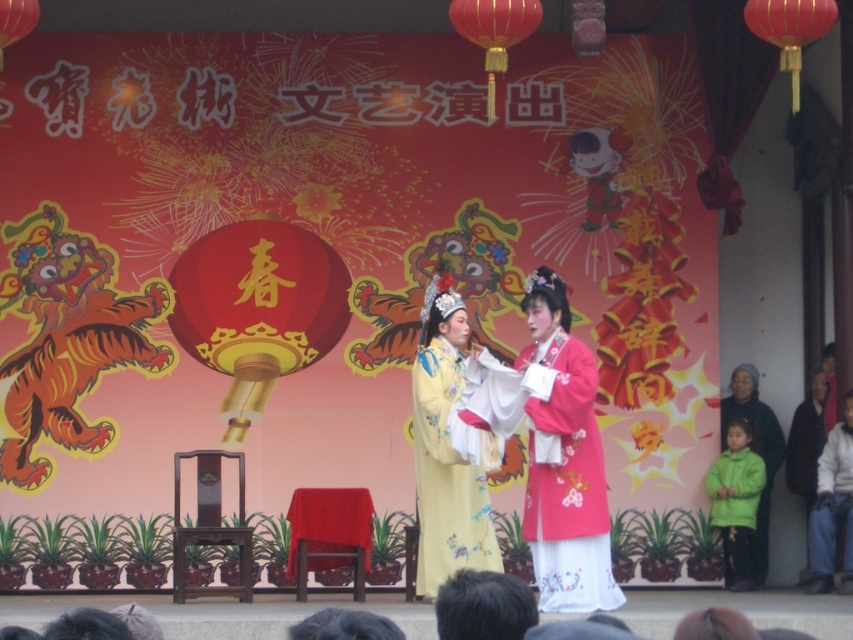
You are a photographer at the back of the stage. You want to capture a clear photo of the matte white coat at right without the green fuzzy coat at lower right blocking it. Is this possible given their positions?

The matte white coat at right is in front of the green fuzzy coat at lower right, so taking a clear photo of the matte white coat at right without the green fuzzy coat at lower right blocking it is possible since it is already positioned in front.

You are a photographer standing at the front of the stage during the performance. You want to capture a closeup shot of the performer wearing the yellow robe with intricate floral patterns. The yellow robe performer is at point (839, 500) and the pink robe performer is at point (779, 445). Which performer is closer to you so that you can focus your camera on them?

Point (839, 500) is closer to the viewer than point (779, 445). Therefore, the performer wearing the yellow robe with intricate floral patterns at point (839, 500) is closer to you, so you should focus your camera on them.